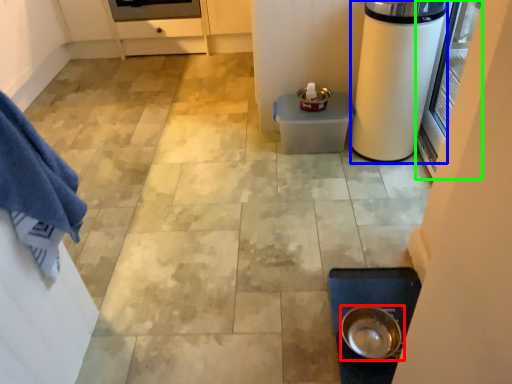
Question: Based on their relative distances, which object is farther from kitchen appliance (highlighted by a red box)? Choose from appliance (highlighted by a blue box) and screen door (highlighted by a green box).

Choices:
 (A) appliance
 (B) screen door

Answer: (B)